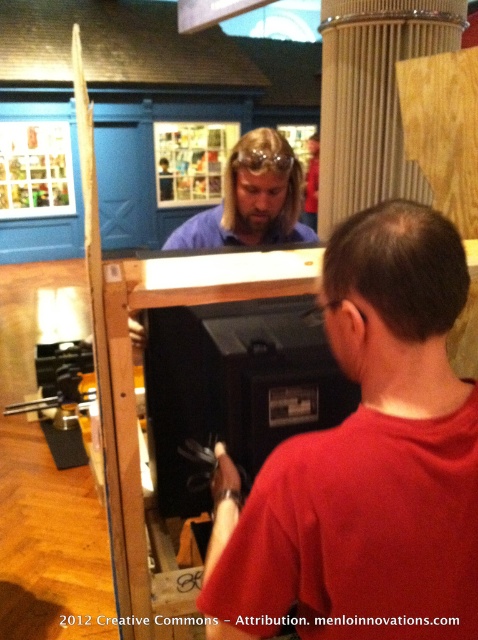
Question: Which of these objects is positioned farthest from the blue matte shirt at center?

Choices:
 (A) red matte shirt at center
 (B) clear plastic goggles at center

Answer: (A)

Question: Is blue matte shirt at center above clear plastic goggles at center?

Choices:
 (A) yes
 (B) no

Answer: (B)

Question: Which point is farther from the camera taking this photo?

Choices:
 (A) (274, 161)
 (B) (283, 182)

Answer: (B)

Question: Where is blue matte shirt at center located in relation to clear plastic goggles at center in the image?

Choices:
 (A) left
 (B) right

Answer: (A)

Question: Where is blue matte shirt at center located in relation to clear plastic goggles at center in the image?

Choices:
 (A) above
 (B) below

Answer: (B)

Question: Which object is positioned closest to the clear plastic goggles at center?

Choices:
 (A) red matte shirt at center
 (B) blue matte shirt at center

Answer: (B)